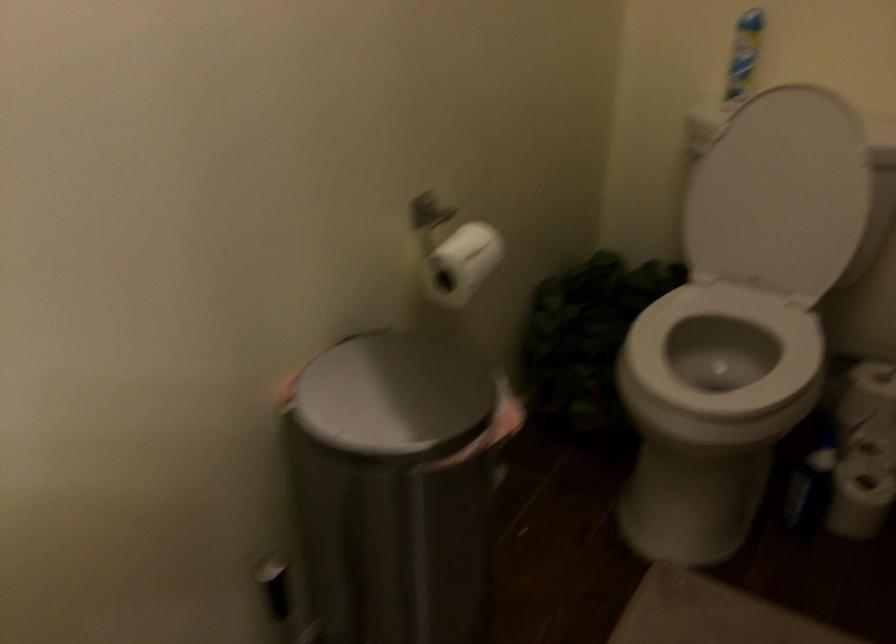
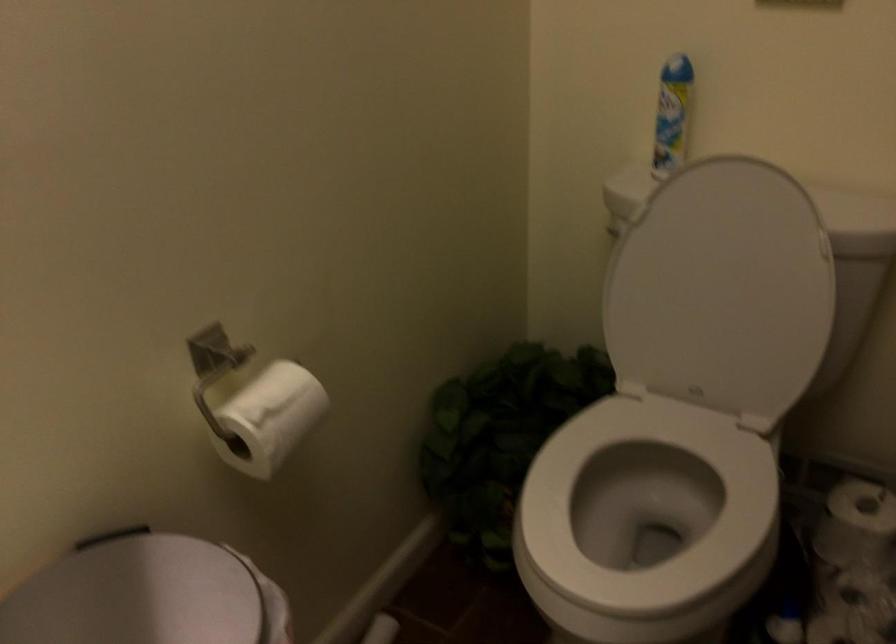
Locate, in the second image, the point that corresponds to the point at 466,261 in the first image.

(271, 417)